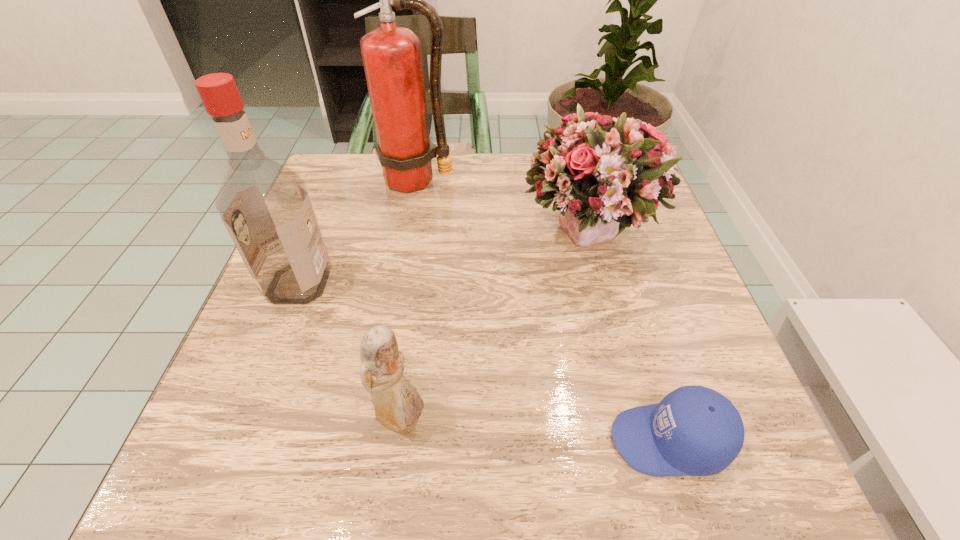
Identify the location of vacant space located 0.340m on the front-facing side of the cap. (382, 440).

You are a GUI agent. You are given a task and a screenshot of the screen. Output one action in this format:
    pyautogui.click(x=<x>, y=<y>)
    Task: Click on the vacant space situated on the front-facing side of the cap
    Image resolution: width=960 pixels, height=540 pixels.
    Given the screenshot: What is the action you would take?
    pyautogui.click(x=402, y=440)

Find the location of a particular element. This screenshot has height=540, width=960. fire extinguisher that is positioned at the far edge is located at coordinates (392, 56).

Identify the location of bouquet that is at the far edge. (604, 174).

Locate an element on the screen. The height and width of the screenshot is (540, 960). figurine present at the near edge is located at coordinates (398, 406).

What are the coordinates of `cap positioned at the near edge` in the screenshot? It's located at (693, 431).

The width and height of the screenshot is (960, 540). Find the location of `fire extinguisher that is at the left edge`. fire extinguisher that is at the left edge is located at coordinates (392, 56).

Locate an element on the screen. liquor that is at the left edge is located at coordinates (264, 205).

Locate an element on the screen. This screenshot has width=960, height=540. bouquet positioned at the right edge is located at coordinates (604, 174).

The height and width of the screenshot is (540, 960). What are the coordinates of `cap positioned at the right edge` in the screenshot? It's located at (693, 431).